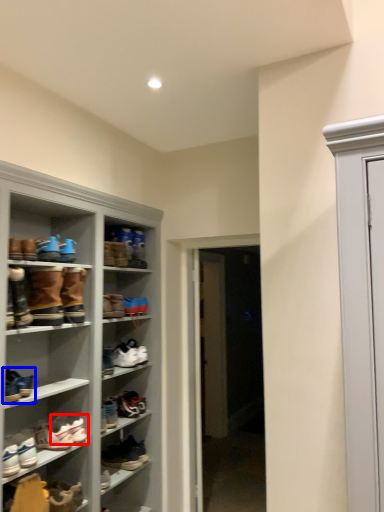
Question: Which point is further to the camera, footwear (highlighted by a red box) or footwear (highlighted by a blue box)?

Choices:
 (A) footwear
 (B) footwear

Answer: (A)